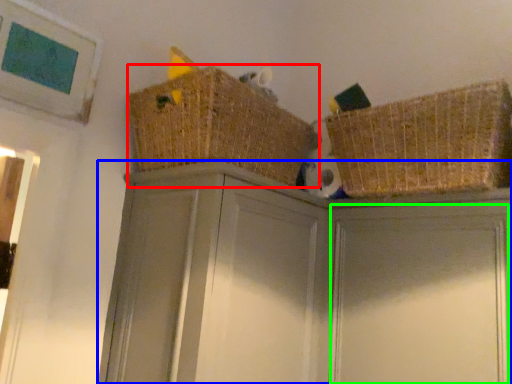
Question: Based on their relative distances, which object is nearer to basket (highlighted by a red box)? Choose from cabinetry (highlighted by a blue box) and door (highlighted by a green box).

Choices:
 (A) cabinetry
 (B) door

Answer: (A)